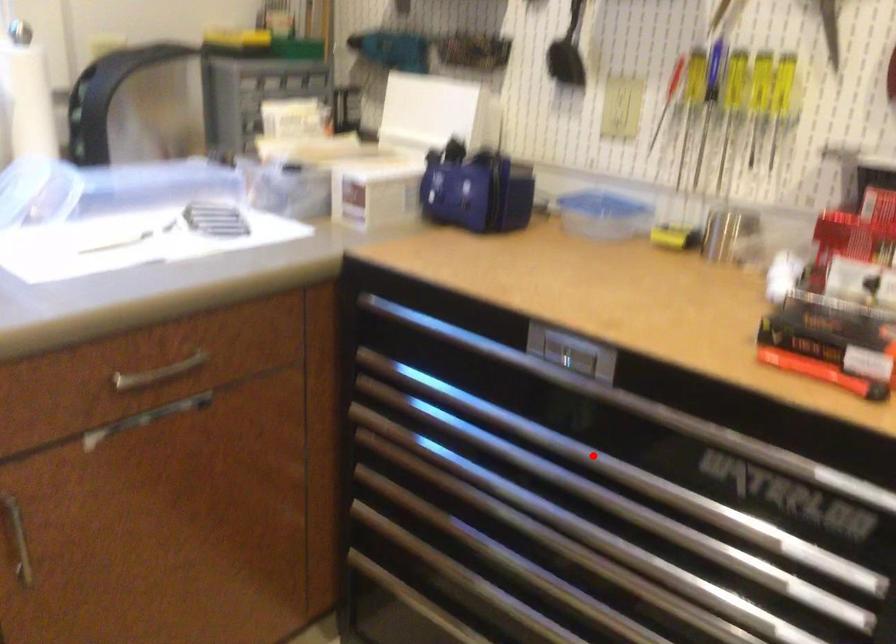
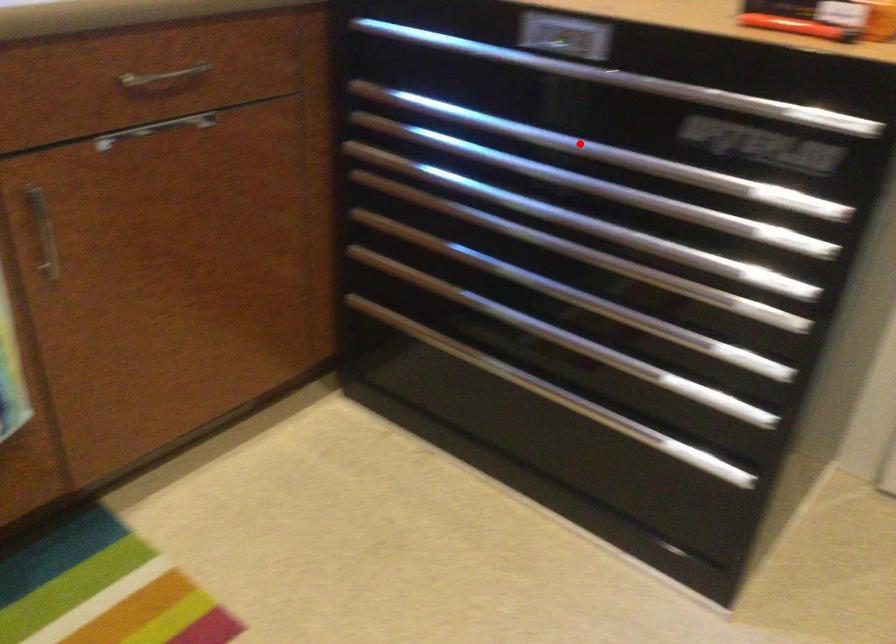
I am providing you with two images of the same scene from different viewpoints. A red point is marked on the first image and another point is marked on the second image. Does the point marked in image1 correspond to the same location as the one in image2?

Yes